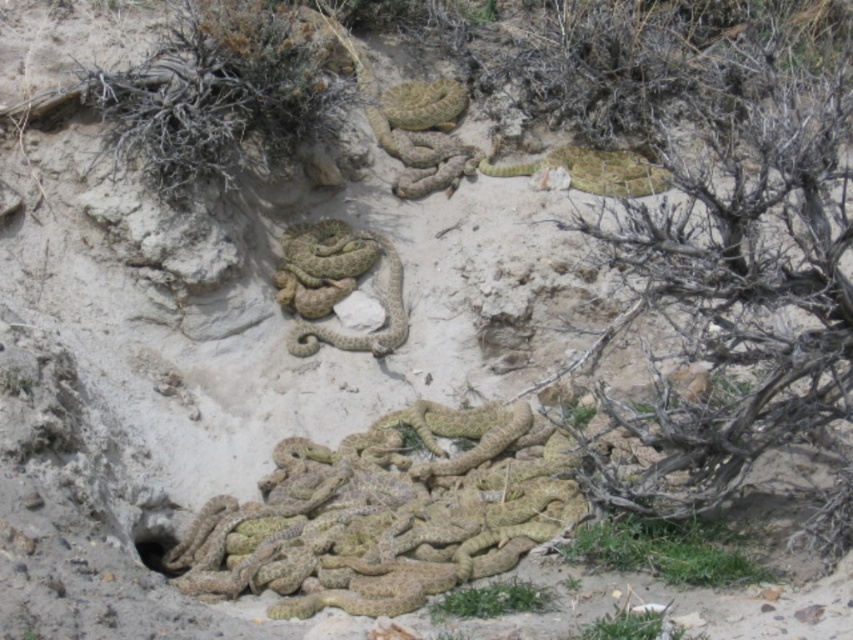
Question: Which object is farther from the camera taking this photo?

Choices:
 (A) camouflage-patterned snake at upper right
 (B) camouflage scales snake at center
 (C) camouflage scales snakes at lower center

Answer: (A)

Question: Can you confirm if camouflage scales snakes at lower center is bigger than camouflage-patterned snake at upper right?

Choices:
 (A) yes
 (B) no

Answer: (A)

Question: Which is farther from the camouflage scales snake at center?

Choices:
 (A) camouflage scales snakes at lower center
 (B) camouflage-patterned snake at upper right

Answer: (B)

Question: Is camouflage scales snakes at lower center thinner than camouflage scales snake at center?

Choices:
 (A) yes
 (B) no

Answer: (B)

Question: Among these points, which one is farthest from the camera?

Choices:
 (A) (387, 273)
 (B) (566, 157)
 (C) (488, 436)

Answer: (B)

Question: Is camouflage scales snake at center to the right of camouflage-patterned snake at upper right from the viewer's perspective?

Choices:
 (A) yes
 (B) no

Answer: (B)